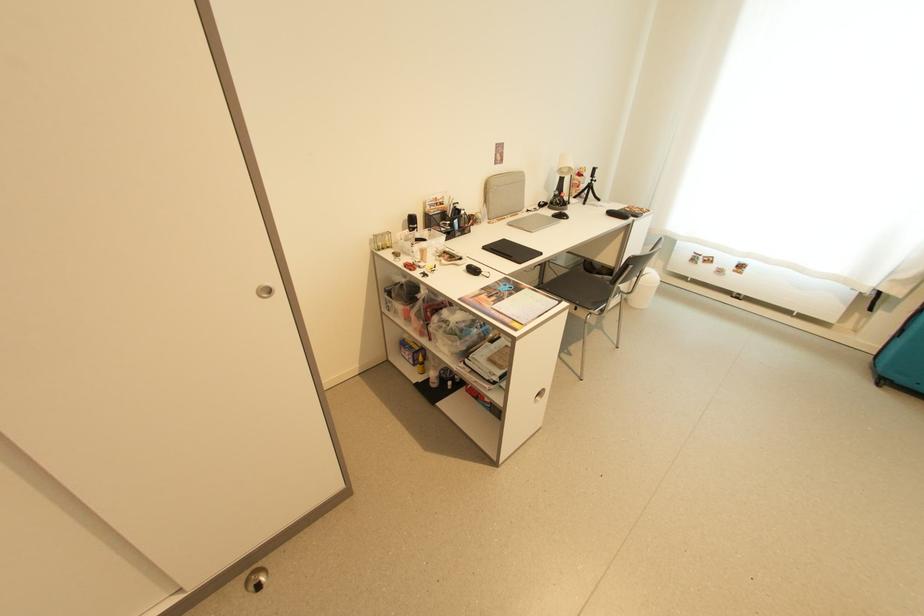
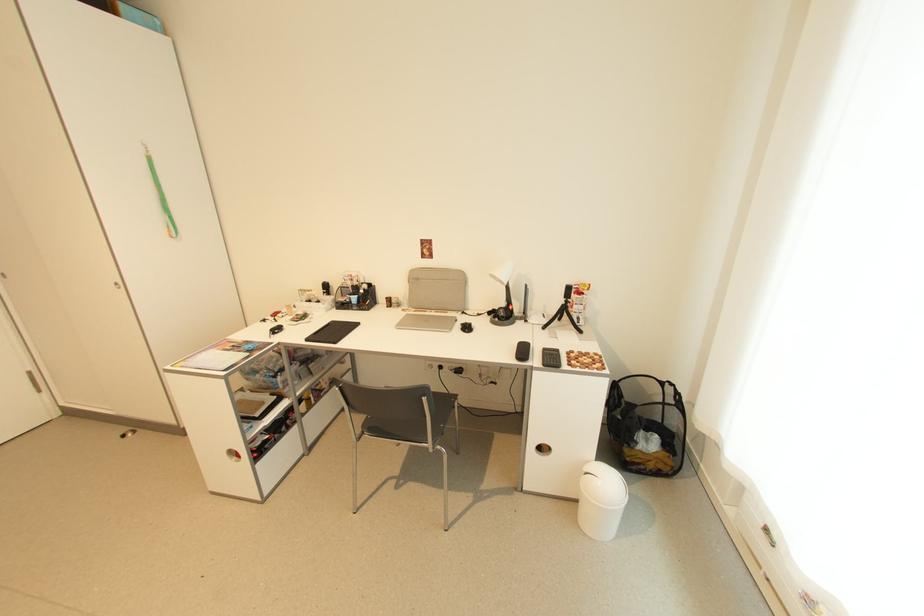
In the second image, find the point that corresponds to point 597,182 in the first image.

(572, 302)